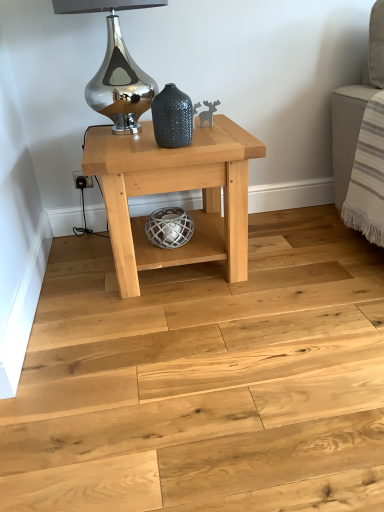
The width and height of the screenshot is (384, 512). I want to click on vacant area that lies to the right of natural wood table at center, so click(301, 261).